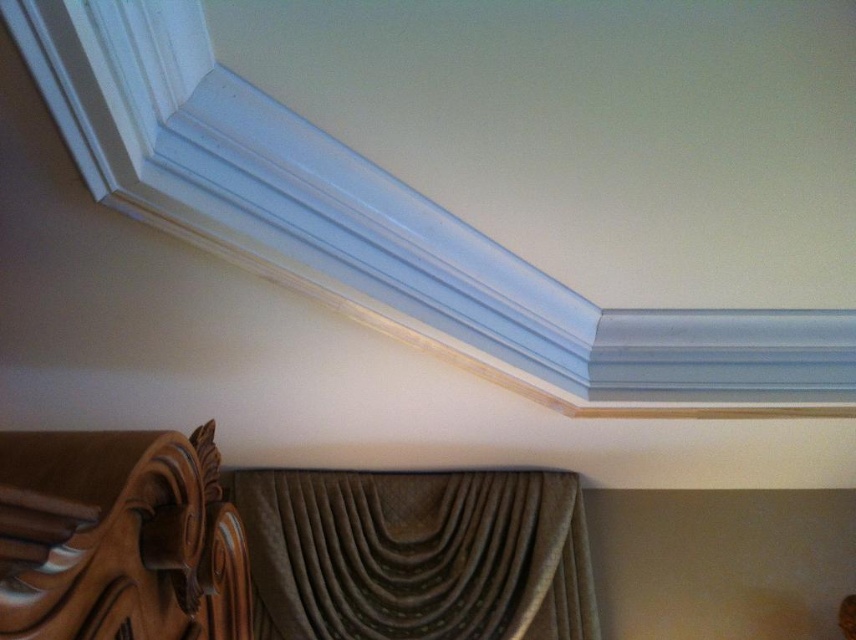
Does brown textured curtain at upper center appear on the right side of brown carved wood bed at lower left?

Yes, brown textured curtain at upper center is to the right of brown carved wood bed at lower left.

In the scene shown: Which of these two, brown textured curtain at upper center or brown carved wood bed at lower left, stands shorter?

brown textured curtain at upper center is shorter.

The height and width of the screenshot is (640, 856). Find the location of `brown textured curtain at upper center`. brown textured curtain at upper center is located at coordinates (415, 554).

Locate an element on the screen. This screenshot has width=856, height=640. white smooth crown molding at upper center is located at coordinates (387, 232).

Who is shorter, white smooth crown molding at upper center or brown textured curtain at upper center?

brown textured curtain at upper center

Who is more forward, (490, 272) or (528, 512)?

Point (490, 272) is in front.

Locate an element on the screen. The width and height of the screenshot is (856, 640). white smooth crown molding at upper center is located at coordinates (387, 232).

Looking at this image, does white smooth crown molding at upper center appear under brown carved wood bed at lower left?

Actually, white smooth crown molding at upper center is above brown carved wood bed at lower left.

Between white smooth crown molding at upper center and brown carved wood bed at lower left, which one appears on the left side from the viewer's perspective?

Positioned to the left is brown carved wood bed at lower left.

The height and width of the screenshot is (640, 856). Describe the element at coordinates (387, 232) in the screenshot. I see `white smooth crown molding at upper center` at that location.

Identify the location of white smooth crown molding at upper center. This screenshot has width=856, height=640. (387, 232).